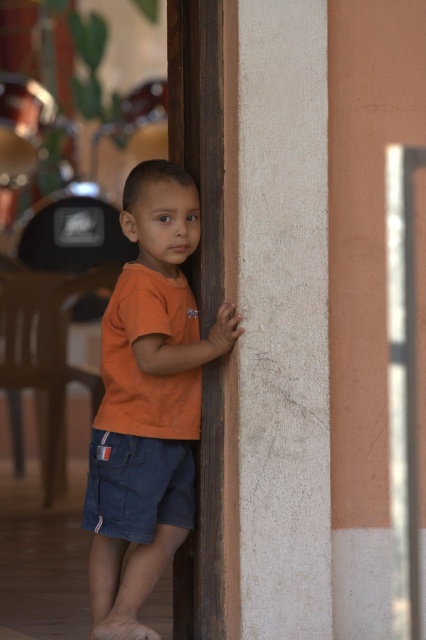
Find the location of a particular element. This screenshot has width=426, height=640. orange cotton shirt at center is located at coordinates (147, 401).

Is orange cotton shirt at center thinner than denim shorts at lower left?

Incorrect, orange cotton shirt at center's width is not less than denim shorts at lower left's.

Is point (146, 452) behind point (92, 524)?

No, (146, 452) is in front of (92, 524).

I want to click on orange cotton shirt at center, so click(x=147, y=401).